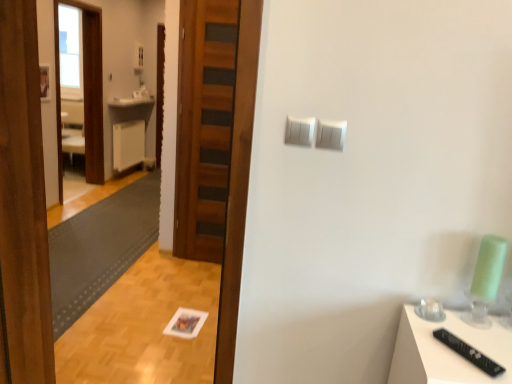
The height and width of the screenshot is (384, 512). In order to click on wooden screen door at left in this screenshot , I will do `click(84, 91)`.

This screenshot has width=512, height=384. What do you see at coordinates (131, 102) in the screenshot?
I see `white glossy counter top at center` at bounding box center [131, 102].

The image size is (512, 384). I want to click on white glossy counter top at center, so click(131, 102).

Where is `dark gray textured mat at lower left`? This screenshot has height=384, width=512. dark gray textured mat at lower left is located at coordinates (100, 247).

The image size is (512, 384). Describe the element at coordinates (128, 144) in the screenshot. I see `white matte radiator at center` at that location.

The image size is (512, 384). In order to click on wooden screen door at left in this screenshot , I will do `click(84, 91)`.

This screenshot has height=384, width=512. In order to click on cabinetry above the wooden door at center (from the image's perspective) in this screenshot , I will do `click(128, 144)`.

Is white matte radiator at center spatially inside wooden door at center, or outside of it?

white matte radiator at center is not enclosed by wooden door at center.

How many degrees apart are the facing directions of white matte radiator at center and wooden door at center?

white matte radiator at center and wooden door at center are facing 89.2 degrees away from each other.

Looking at this image, based on their positions, is white plastic light switch at upper center, positioned as the 1th light switch in left-to-right order, located to the left or right of wooden screen door at left?

Clearly, white plastic light switch at upper center, positioned as the 1th light switch in left-to-right order, is on the right of wooden screen door at left in the image.

Relative to wooden screen door at left, is white plastic light switch at upper center, which is the 2th light switch in right-to-left order, in front or behind?

In the image, white plastic light switch at upper center, which is the 2th light switch in right-to-left order, appears in front of wooden screen door at left.

Measure the distance between white plastic light switch at upper center, which is the 2th light switch in right-to-left order, and wooden screen door at left.

A distance of 4.83 meters exists between white plastic light switch at upper center, which is the 2th light switch in right-to-left order, and wooden screen door at left.

Is white plastic light switch at upper center, positioned as the 1th light switch in left-to-right order, oriented towards wooden screen door at left?

No, white plastic light switch at upper center, positioned as the 1th light switch in left-to-right order, does not turn towards wooden screen door at left.

Looking at the image, does wooden door at center seem bigger or smaller compared to white matte radiator at center?

wooden door at center is smaller than white matte radiator at center.

Is wooden door at center situated inside white matte radiator at center or outside?

wooden door at center exists outside the volume of white matte radiator at center.

Could you tell me if wooden door at center is turned towards white matte radiator at center?

No, wooden door at center does not turn towards white matte radiator at center.

Between white glossy counter top at center and wooden screen door at left, which one has less height?

With less height is white glossy counter top at center.

Which object is wider, white glossy counter top at center or wooden screen door at left?

wooden screen door at left is wider.

Is white glossy counter top at center not near wooden screen door at left?

No, white glossy counter top at center is in close proximity to wooden screen door at left.

Which is behind, white glossy counter top at center or wooden screen door at left?

white glossy counter top at center is more distant.

Considering the positions of objects white glossy counter top at center and wooden door at center in the image provided, who is behind, white glossy counter top at center or wooden door at center?

white glossy counter top at center is further away from the camera.

Based on the photo, is white glossy counter top at center in contact with wooden door at center?

No, white glossy counter top at center is not next to wooden door at center.

Between white glossy counter top at center and wooden door at center, which one has larger size?

white glossy counter top at center is bigger.

How much distance is there between wooden door at center and white plastic light switch at upper center, the second light switch positioned from the left?

wooden door at center and white plastic light switch at upper center, the second light switch positioned from the left, are 2.16 meters apart.

Between wooden door at center and white plastic light switch at upper center, which is the 1th light switch in right-to-left order, which one has less height?

white plastic light switch at upper center, which is the 1th light switch in right-to-left order, is shorter.

Does wooden door at center turn towards white plastic light switch at upper center, the second light switch positioned from the left?

No, wooden door at center is not oriented towards white plastic light switch at upper center, the second light switch positioned from the left.

Considering the sizes of objects wooden door at center and white plastic light switch at upper center, the second light switch positioned from the left, in the image provided, who is bigger, wooden door at center or white plastic light switch at upper center, the second light switch positioned from the left,?

Bigger between the two is wooden door at center.

From the image's perspective, is dark gray textured mat at lower left above white plastic light switch at upper center, positioned as the 1th light switch in left-to-right order?

No, from the image's perspective, dark gray textured mat at lower left is not over white plastic light switch at upper center, positioned as the 1th light switch in left-to-right order.

From a real-world perspective, which is physically below, dark gray textured mat at lower left or white plastic light switch at upper center, which is the 2th light switch in right-to-left order?

dark gray textured mat at lower left is physically lower.

How distant is dark gray textured mat at lower left from white plastic light switch at upper center, which is the 2th light switch in right-to-left order?

dark gray textured mat at lower left is 3.07 meters from white plastic light switch at upper center, which is the 2th light switch in right-to-left order.

Is dark gray textured mat at lower left next to white plastic light switch at upper center, positioned as the 1th light switch in left-to-right order, and touching it?

dark gray textured mat at lower left is not next to white plastic light switch at upper center, positioned as the 1th light switch in left-to-right order, and they're not touching.

At what (x,y) coordinates should I click in order to perform the action: click on cabinetry on the left side of wooden door at center. Please return your answer as a coordinate pair (x, y). The height and width of the screenshot is (384, 512). Looking at the image, I should click on (128, 144).

Locate an element on the screen. Image resolution: width=512 pixels, height=384 pixels. screen door above the white plastic light switch at upper center, which is the 2th light switch in right-to-left order (from the image's perspective) is located at coordinates (84, 91).

Which object lies further to the anchor point wooden screen door at left, white plastic light switch at upper center, which is the 1th light switch in right-to-left order, or dark gray textured mat at lower left?

Among the two, white plastic light switch at upper center, which is the 1th light switch in right-to-left order, is located further to wooden screen door at left.

Estimate the real-world distances between objects in this image. Which object is further from white glossy counter top at center, dark gray textured mat at lower left or wooden door at center?

wooden door at center lies further to white glossy counter top at center than the other object.

From the image, which object appears to be nearer to white glossy counter top at center, white plastic light switch at upper center, the second light switch positioned from the left, or white plastic light switch at upper center, positioned as the 1th light switch in left-to-right order?

white plastic light switch at upper center, positioned as the 1th light switch in left-to-right order, is closer to white glossy counter top at center.

Looking at the image, which one is located further to wooden screen door at left, wooden door at center or white glossy counter top at center?

wooden door at center lies further to wooden screen door at left than the other object.

In the scene shown: When comparing their distances from white matte radiator at center, does white plastic light switch at upper center, positioned as the 1th light switch in left-to-right order, or white plastic light switch at upper center, the second light switch positioned from the left, seem further?

Based on the image, white plastic light switch at upper center, the second light switch positioned from the left, appears to be further to white matte radiator at center.

Considering their positions, is wooden door at center positioned further to white plastic light switch at upper center, positioned as the 1th light switch in left-to-right order, than white glossy counter top at center?

white glossy counter top at center is positioned further to the anchor white plastic light switch at upper center, positioned as the 1th light switch in left-to-right order.

From the image, which object appears to be nearer to wooden door at center, wooden screen door at left or dark gray textured mat at lower left?

The object closer to wooden door at center is dark gray textured mat at lower left.

Considering their positions, is white plastic light switch at upper center, which is the 1th light switch in right-to-left order, positioned closer to wooden screen door at left than white matte radiator at center?

white matte radiator at center lies closer to wooden screen door at left than the other object.

At what (x,y) coordinates should I click in order to perform the action: click on mat between white plastic light switch at upper center, the second light switch positioned from the left, and wooden door at center from front to back. Please return your answer as a coordinate pair (x, y). The width and height of the screenshot is (512, 384). Looking at the image, I should click on (100, 247).

The height and width of the screenshot is (384, 512). What are the coordinates of `counter top between dark gray textured mat at lower left and white matte radiator at center in the front-back direction` in the screenshot? It's located at (131, 102).

Where is `door between dark gray textured mat at lower left and white glossy counter top at center in the front-back direction`? Image resolution: width=512 pixels, height=384 pixels. door between dark gray textured mat at lower left and white glossy counter top at center in the front-back direction is located at coordinates (204, 126).

Image resolution: width=512 pixels, height=384 pixels. Find the location of `mat between white plastic light switch at upper center, the second light switch positioned from the left, and white matte radiator at center in the front-back direction`. mat between white plastic light switch at upper center, the second light switch positioned from the left, and white matte radiator at center in the front-back direction is located at coordinates (100, 247).